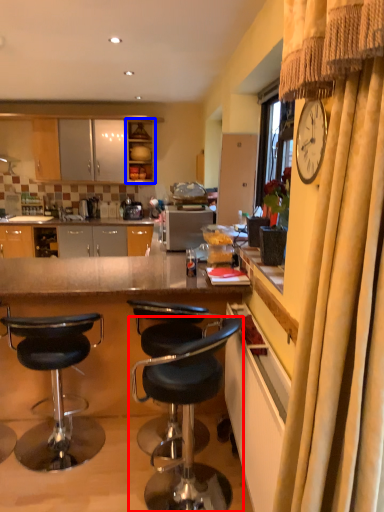
Question: Which point is closer to the camera, chair (highlighted by a red box) or cabinetry (highlighted by a blue box)?

Choices:
 (A) chair
 (B) cabinetry

Answer: (A)